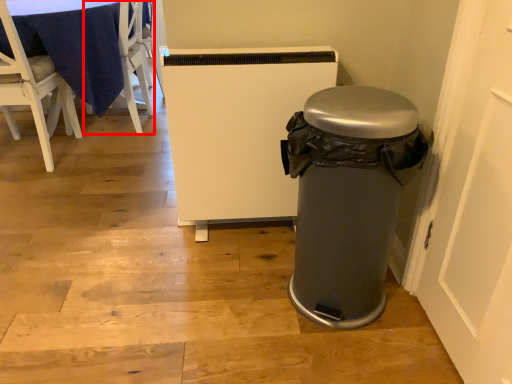
Question: From the image, what is the correct spatial relationship of chair (annotated by the red box) in relation to chair?

Choices:
 (A) right
 (B) left

Answer: (A)